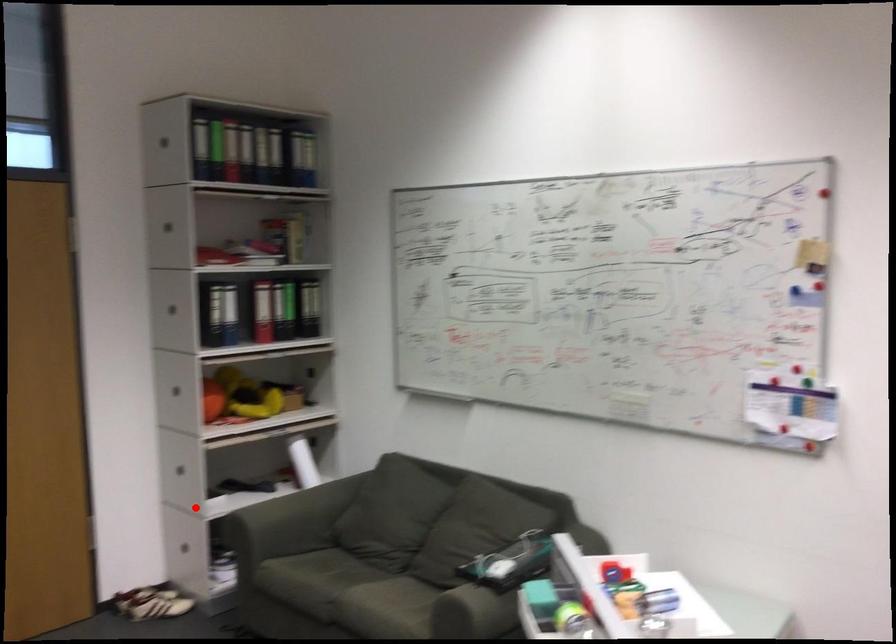
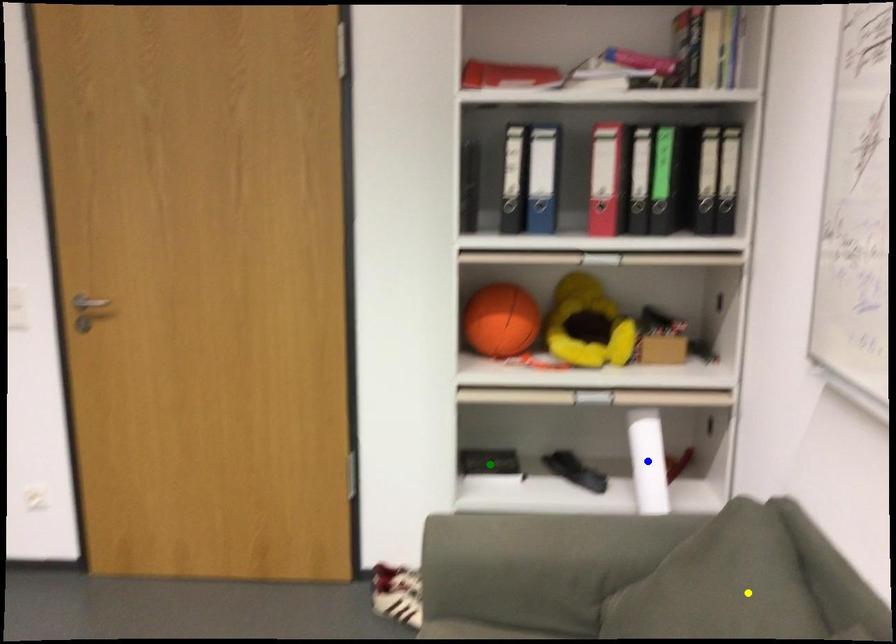
Question: I am providing you with two images of the same scene from different viewpoints. A red point is marked on the first image. You are given multiple points on the second image. Which point in image 2 is actually the same real-world point as the red point in image 1?

Choices:
 (A) green point
 (B) blue point
 (C) yellow point

Answer: (A)